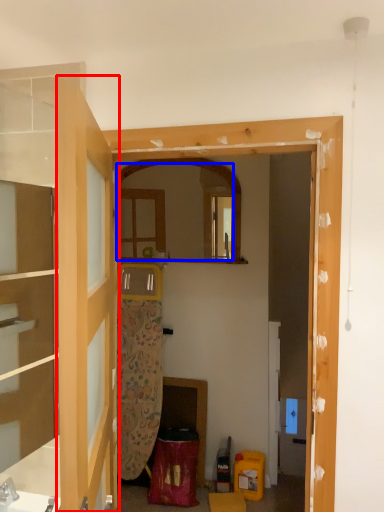
Question: Among these objects, which one is farthest to the camera, door (highlighted by a red box) or mirror (highlighted by a blue box)?

Choices:
 (A) door
 (B) mirror

Answer: (B)